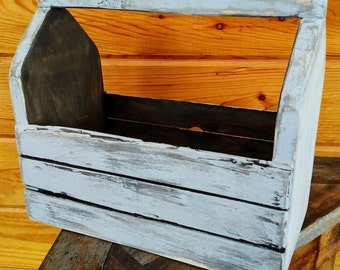
I want to click on handle, so click(x=295, y=5).